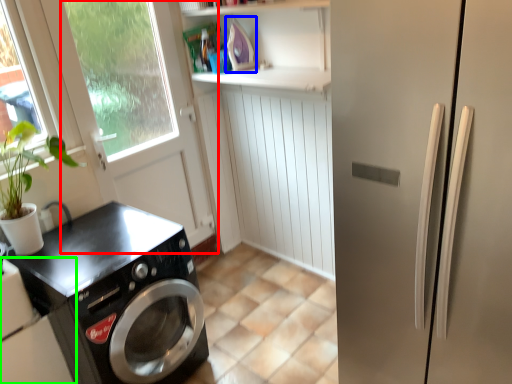
Question: Which object is the closest to the screen door (highlighted by a red box)? Choose among these: appliance (highlighted by a blue box) or home appliance (highlighted by a green box).

Choices:
 (A) appliance
 (B) home appliance

Answer: (A)